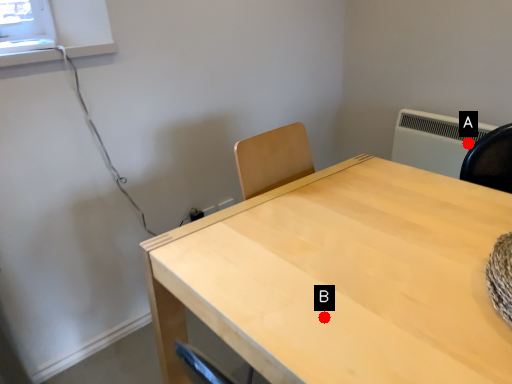
Question: Two points are circled on the image, labeled by A and B beside each circle. Which point appears closest to the camera in this image?

Choices:
 (A) A is closer
 (B) B is closer

Answer: (B)